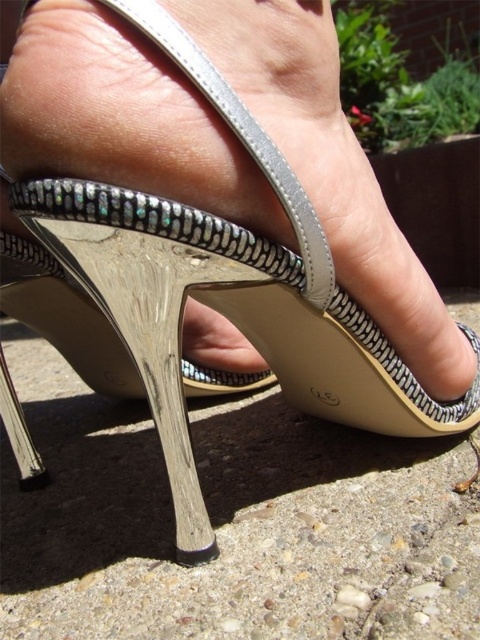
Between point (457, 627) and point (324, 204), which one is positioned in front?

Point (457, 627) is more forward.

Who is positioned more to the left, smooth concrete at center or metallic leather sandal at center?

From the viewer's perspective, smooth concrete at center appears more on the left side.

Does point (12, 371) lie behind point (212, 196)?

Yes, point (12, 371) is behind point (212, 196).

Locate an element on the screen. Image resolution: width=480 pixels, height=640 pixels. smooth concrete at center is located at coordinates (229, 522).